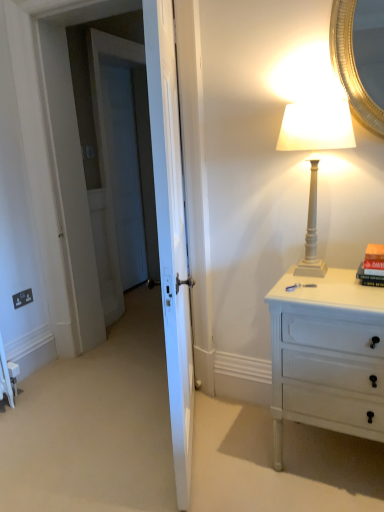
The width and height of the screenshot is (384, 512). What are the coordinates of `free spot in front of white matte lamp at upper right` in the screenshot? It's located at (334, 292).